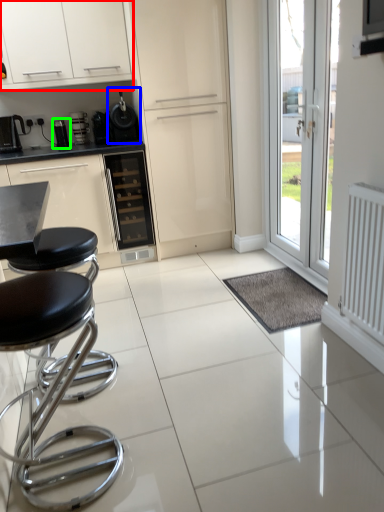
Question: Which is farther away from cabinetry (highlighted by a red box)? appliance (highlighted by a blue box) or appliance (highlighted by a green box)?

Choices:
 (A) appliance
 (B) appliance

Answer: (B)